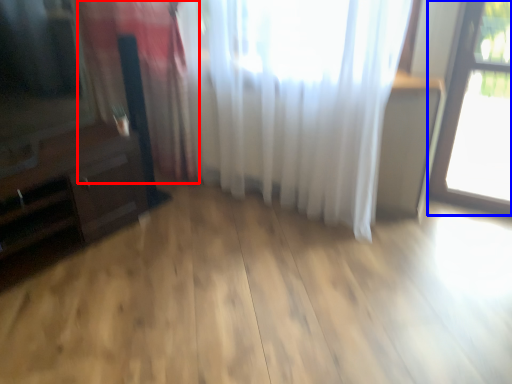
Question: Among these objects, which one is nearest to the camera, curtain (highlighted by a red box) or window (highlighted by a blue box)?

Choices:
 (A) curtain
 (B) window

Answer: (B)